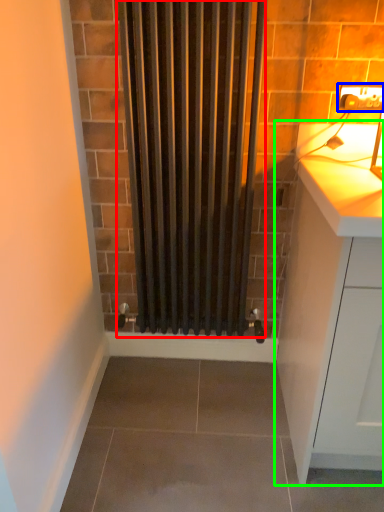
Question: Which object is positioned farthest from shower curtain (highlighted by a red box)? Select from electric outlet (highlighted by a blue box) and cabinetry (highlighted by a green box).

Choices:
 (A) electric outlet
 (B) cabinetry

Answer: (A)